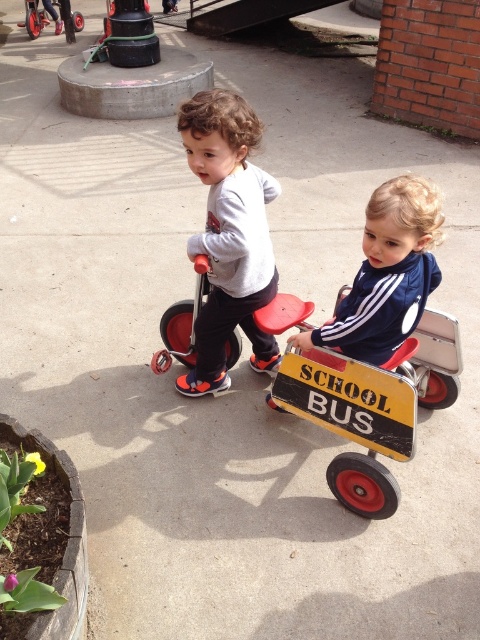
You are a parent trying to dress your child for a cold day. You have two options from the image, the gray matte shirt at center and the blue smooth jacket at center. Which one would provide better insulation based on their thickness?

The gray matte shirt at center is thinner than the blue smooth jacket at center, so the blue smooth jacket at center would provide better insulation.

You are a photographer trying to capture a clear shot of the blue smooth jacket at center without the gray matte shirt at center blocking it. Can you adjust your angle to do so?

The gray matte shirt at center is positioned over the blue smooth jacket at center, so adjusting your angle might not be possible as the gray matte shirt is directly blocking the blue smooth jacket.